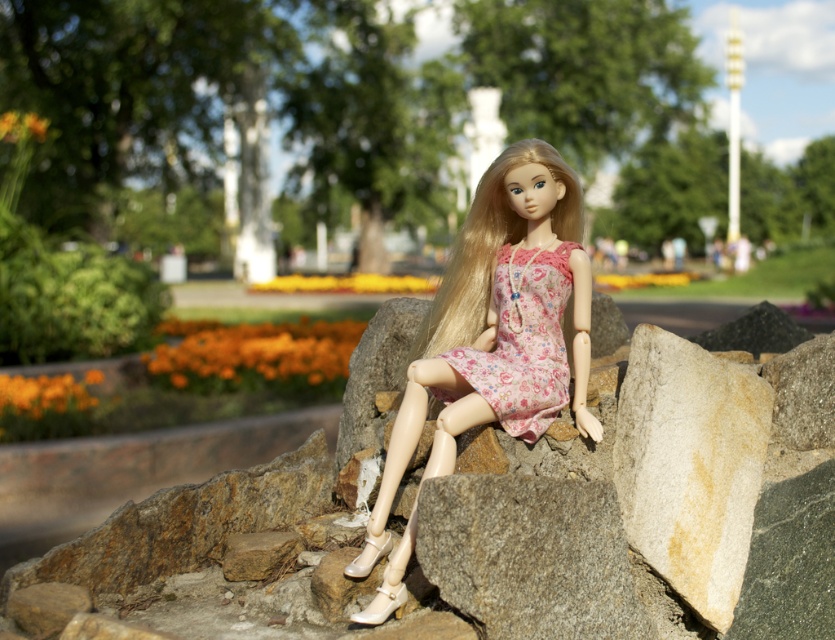
Is point (451, 422) more distant than point (353, 572)?

Yes, point (451, 422) is farther from viewer.

The image size is (835, 640). What are the coordinates of `pink floral dress at center` in the screenshot? It's located at (501, 320).

I want to click on pink floral dress at center, so click(x=501, y=320).

Identify the location of pink floral dress at center. (501, 320).

Is point (560, 300) positioned before point (375, 563)?

That is False.

Is floral fabric dress at center bigger than pearl white leather shoe at lower center?

Indeed, floral fabric dress at center has a larger size compared to pearl white leather shoe at lower center.

Between point (517, 324) and point (365, 541), which one is positioned in front?

Positioned in front is point (365, 541).

Where is `floral fabric dress at center`? floral fabric dress at center is located at coordinates (524, 340).

Can you confirm if white leather shoe at lower center is wider than pearl white leather shoe at lower center?

Yes, white leather shoe at lower center is wider than pearl white leather shoe at lower center.

Can you confirm if white leather shoe at lower center is positioned below pearl white leather shoe at lower center?

Yes, white leather shoe at lower center is below pearl white leather shoe at lower center.

Identify the location of white leather shoe at lower center. The width and height of the screenshot is (835, 640). (383, 605).